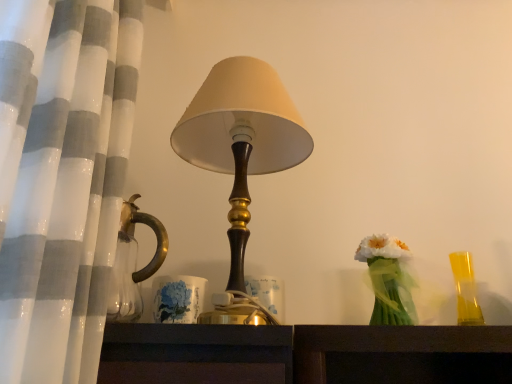
Question: Can you confirm if translucent green vase at right is positioned to the left of translucent yellow glass at right?

Choices:
 (A) no
 (B) yes

Answer: (B)

Question: Is translucent green vase at right oriented away from translucent yellow glass at right?

Choices:
 (A) no
 (B) yes

Answer: (A)

Question: Does translucent green vase at right have a greater height compared to translucent yellow glass at right?

Choices:
 (A) yes
 (B) no

Answer: (A)

Question: Is translucent green vase at right further to the viewer compared to translucent yellow glass at right?

Choices:
 (A) yes
 (B) no

Answer: (B)

Question: Can you confirm if translucent green vase at right is smaller than translucent yellow glass at right?

Choices:
 (A) yes
 (B) no

Answer: (B)

Question: From a real-world perspective, is white sheer curtain at left positioned above or below matte brown lampshade at center?

Choices:
 (A) above
 (B) below

Answer: (A)

Question: Considering their positions, is white sheer curtain at left located in front of or behind matte brown lampshade at center?

Choices:
 (A) front
 (B) behind

Answer: (A)

Question: Is white sheer curtain at left to the left or to the right of matte brown lampshade at center in the image?

Choices:
 (A) left
 (B) right

Answer: (A)

Question: Is white sheer curtain at left wider or thinner than matte brown lampshade at center?

Choices:
 (A) wide
 (B) thin

Answer: (A)

Question: In the image, is matte brown lampshade at center positioned in front of or behind translucent yellow glass at right?

Choices:
 (A) behind
 (B) front

Answer: (B)

Question: Would you say matte brown lampshade at center is to the left or to the right of translucent yellow glass at right in the picture?

Choices:
 (A) right
 (B) left

Answer: (B)

Question: Is matte brown lampshade at center wider or thinner than translucent yellow glass at right?

Choices:
 (A) thin
 (B) wide

Answer: (B)

Question: Choose the correct answer: Is matte brown lampshade at center inside translucent yellow glass at right or outside it?

Choices:
 (A) outside
 (B) inside

Answer: (A)

Question: Is translucent yellow glass at right inside the boundaries of matte brown lampshade at center, or outside?

Choices:
 (A) outside
 (B) inside

Answer: (A)

Question: Is translucent yellow glass at right bigger or smaller than matte brown lampshade at center?

Choices:
 (A) big
 (B) small

Answer: (B)